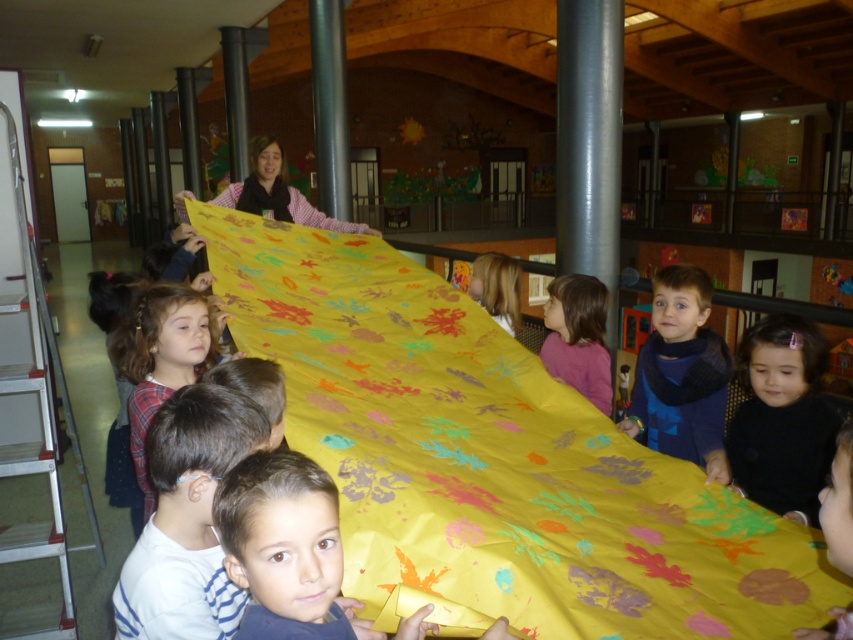
Question: Which point is farther to the camera?

Choices:
 (A) white striped shirt at lower center
 (B) plaid fabric at center

Answer: (B)

Question: Which object appears closest to the camera in this image?

Choices:
 (A) blonde hair at center
 (B) smooth yellow fabric at center

Answer: (B)

Question: Can you confirm if white striped shirt at lower center is positioned above plaid fabric at center?

Choices:
 (A) no
 (B) yes

Answer: (A)

Question: Does plaid fabric at center have a lesser width compared to blonde hair at center?

Choices:
 (A) yes
 (B) no

Answer: (B)

Question: Can you confirm if white striped shirt at lower center is thinner than smooth yellow fabric at center?

Choices:
 (A) yes
 (B) no

Answer: (B)

Question: Which object is farther from the camera taking this photo?

Choices:
 (A) black matte hairband at lower right
 (B) blonde hair at center

Answer: (B)